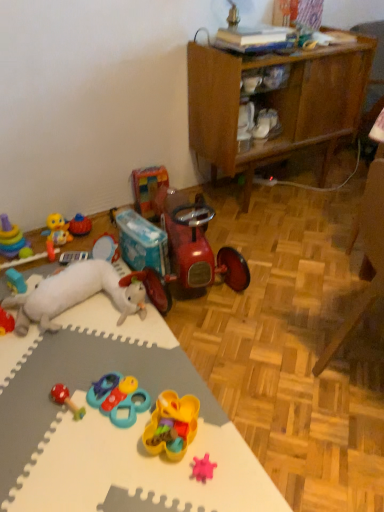
Locate an element on the screen. The image size is (384, 512). vacant space to the right of pink rubber star at lower center, placed as the twelfth toy when sorted from left to right is located at coordinates (244, 473).